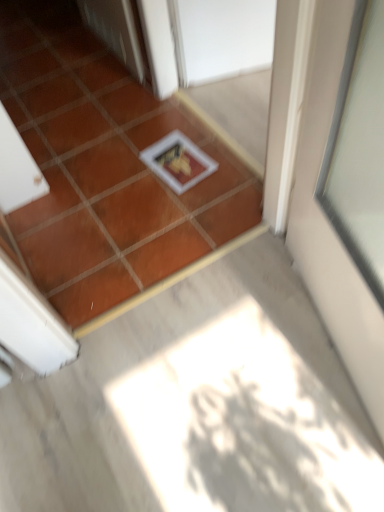
Locate an element on the screen. The image size is (384, 512). white glossy frame at center is located at coordinates (197, 406).

This screenshot has width=384, height=512. What do you see at coordinates (197, 406) in the screenshot?
I see `white glossy frame at center` at bounding box center [197, 406].

Image resolution: width=384 pixels, height=512 pixels. What are the coordinates of `white glossy frame at center` in the screenshot? It's located at click(x=197, y=406).